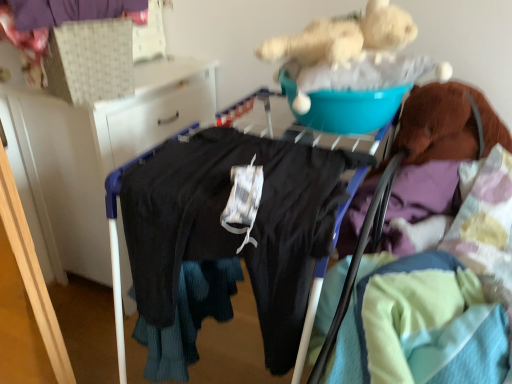
I want to click on purple fabric at upper left, which is counted as the 2th clothing, starting from the bottom, so click(x=67, y=11).

Locate an element on the screen. black matte pants at center, placed as the second clothing when sorted from left to right is located at coordinates click(226, 240).

Measure the distance between black matte pants at center, the 2th clothing when ordered from top to bottom, and camera.

black matte pants at center, the 2th clothing when ordered from top to bottom, is 31.65 inches away from camera.

Locate an element on the screen. black fabric at left is located at coordinates (98, 153).

Identify the location of purple fabric at upper left, which ranks as the second clothing in right-to-left order. The height and width of the screenshot is (384, 512). (67, 11).

Visually, is black fabric at left positioned to the left or to the right of purple fabric at upper left, the 1th clothing viewed from the left?

Clearly, black fabric at left is on the left of purple fabric at upper left, the 1th clothing viewed from the left, in the image.

In the scene shown: From a real-world perspective, relative to purple fabric at upper left, which is counted as the 2th clothing, starting from the bottom, is black fabric at left vertically above or below?

black fabric at left is below purple fabric at upper left, which is counted as the 2th clothing, starting from the bottom.

Does black fabric at left have a larger size compared to purple fabric at upper left, the first clothing from the top?

Correct, black fabric at left is larger in size than purple fabric at upper left, the first clothing from the top.

Is purple fabric at upper left, which is counted as the 2th clothing, starting from the bottom, positioned before black fabric at left?

Yes, purple fabric at upper left, which is counted as the 2th clothing, starting from the bottom, is closer to the viewer.

Which object is wider, purple fabric at upper left, which ranks as the second clothing in right-to-left order, or black fabric at left?

black fabric at left.

Is black fabric at left completely or partially inside purple fabric at upper left, the first clothing from the top?

No, purple fabric at upper left, the first clothing from the top, does not contain black fabric at left.

From the image's perspective, is purple fabric at upper left, the 1th clothing viewed from the left, above or below black fabric at left?

From the image's perspective, purple fabric at upper left, the 1th clothing viewed from the left, appears above black fabric at left.

In the scene shown: From a real-world perspective, who is located lower, purple fabric at upper left, which is counted as the 2th clothing, starting from the bottom, or black matte pants at center, the 2th clothing when ordered from top to bottom?

black matte pants at center, the 2th clothing when ordered from top to bottom, from a real-world perspective.

Which object is wider, purple fabric at upper left, the 1th clothing viewed from the left, or black matte pants at center, the first clothing positioned from the bottom?

With larger width is black matte pants at center, the first clothing positioned from the bottom.

Is purple fabric at upper left, the 1th clothing viewed from the left, smaller than black matte pants at center, placed as the second clothing when sorted from left to right?

Indeed, purple fabric at upper left, the 1th clothing viewed from the left, has a smaller size compared to black matte pants at center, placed as the second clothing when sorted from left to right.

In the image, there is a black matte pants at center, which appears as the 1th clothing when viewed from the right. Identify the location of clothing above it (from the image's perspective). (67, 11).

Is black fabric at left in contact with black matte pants at center, the 2th clothing when ordered from top to bottom?

There is a gap between black fabric at left and black matte pants at center, the 2th clothing when ordered from top to bottom.

Which object is positioned more to the left, black fabric at left or black matte pants at center, placed as the second clothing when sorted from left to right?

Positioned to the left is black fabric at left.

From a real-world perspective, between black fabric at left and black matte pants at center, which appears as the 1th clothing when viewed from the right, who is vertically lower?

black matte pants at center, which appears as the 1th clothing when viewed from the right, is physically lower.

Considering the sizes of black matte pants at center, the first clothing positioned from the bottom, and black fabric at left in the image, is black matte pants at center, the first clothing positioned from the bottom, wider or thinner than black fabric at left?

In the image, black matte pants at center, the first clothing positioned from the bottom, appears to be wider than black fabric at left.

Is black matte pants at center, the 2th clothing when ordered from top to bottom, situated inside black fabric at left or outside?

black matte pants at center, the 2th clothing when ordered from top to bottom, exists outside the volume of black fabric at left.

From a real-world perspective, which is physically above, black matte pants at center, placed as the second clothing when sorted from left to right, or black fabric at left?

In real-world perspective, black fabric at left is above.

Which clothing is the 2nd one when counting from the front of the black fabric at left? Please provide its 2D coordinates.

[(226, 240)]

Who is more distant, black matte pants at center, the 2th clothing when ordered from top to bottom, or purple fabric at upper left, which is counted as the 2th clothing, starting from the bottom?

purple fabric at upper left, which is counted as the 2th clothing, starting from the bottom, is more distant.

Considering the relative sizes of black matte pants at center, the 2th clothing when ordered from top to bottom, and purple fabric at upper left, the first clothing from the top, in the image provided, is black matte pants at center, the 2th clothing when ordered from top to bottom, taller than purple fabric at upper left, the first clothing from the top,?

Yes, black matte pants at center, the 2th clothing when ordered from top to bottom, is taller than purple fabric at upper left, the first clothing from the top.

This screenshot has height=384, width=512. I want to click on clothing that is on the right side of purple fabric at upper left, the 1th clothing viewed from the left, so click(226, 240).

What's the angular difference between black matte pants at center, placed as the second clothing when sorted from left to right, and purple fabric at upper left, the 1th clothing viewed from the left,'s facing directions?

The facing directions of black matte pants at center, placed as the second clothing when sorted from left to right, and purple fabric at upper left, the 1th clothing viewed from the left, are 26.7 degrees apart.

The height and width of the screenshot is (384, 512). I want to click on clothing that is the 1st one when counting forward from the black fabric at left, so click(67, 11).

Where is `furniture that is under the purple fabric at upper left, the first clothing from the top (from a real-world perspective)`? This screenshot has height=384, width=512. furniture that is under the purple fabric at upper left, the first clothing from the top (from a real-world perspective) is located at coordinates (98, 153).

Looking at the image, which one is located closer to black fabric at left, black matte pants at center, the 2th clothing when ordered from top to bottom, or purple fabric at upper left, which is counted as the 2th clothing, starting from the bottom?

purple fabric at upper left, which is counted as the 2th clothing, starting from the bottom, lies closer to black fabric at left than the other object.

When comparing their distances from black fabric at left, does purple fabric at upper left, which ranks as the second clothing in right-to-left order, or black matte pants at center, which appears as the 1th clothing when viewed from the right, seem further?

Based on the image, black matte pants at center, which appears as the 1th clothing when viewed from the right, appears to be further to black fabric at left.

Based on their spatial positions, is purple fabric at upper left, the first clothing from the top, or black fabric at left further from black matte pants at center, placed as the second clothing when sorted from left to right?

purple fabric at upper left, the first clothing from the top, is further to black matte pants at center, placed as the second clothing when sorted from left to right.

Based on their spatial positions, is black fabric at left or black matte pants at center, which appears as the 1th clothing when viewed from the right, further from purple fabric at upper left, the first clothing from the top?

black matte pants at center, which appears as the 1th clothing when viewed from the right.

Considering their positions, is black matte pants at center, which appears as the 1th clothing when viewed from the right, positioned further to purple fabric at upper left, which is counted as the 2th clothing, starting from the bottom, than black fabric at left?

The object further to purple fabric at upper left, which is counted as the 2th clothing, starting from the bottom, is black matte pants at center, which appears as the 1th clothing when viewed from the right.

Estimate the real-world distances between objects in this image. Which object is closer to black matte pants at center, the 2th clothing when ordered from top to bottom, black fabric at left or purple fabric at upper left, the first clothing from the top?

black fabric at left is closer to black matte pants at center, the 2th clothing when ordered from top to bottom.

Find the location of a particular element. This screenshot has width=512, height=384. furniture between purple fabric at upper left, which is counted as the 2th clothing, starting from the bottom, and black matte pants at center, the first clothing positioned from the bottom, in the up-down direction is located at coordinates (98, 153).